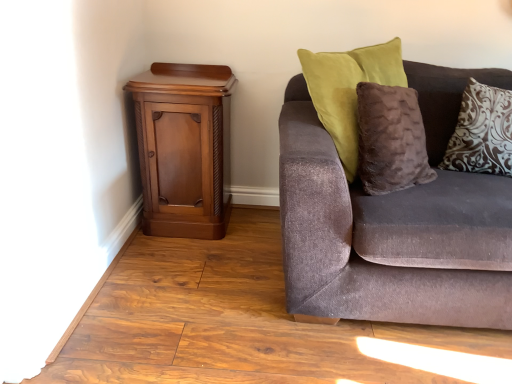
Question: Considering the relative sizes of velvet brown couch at right and brown damask pillow at upper right in the image provided, is velvet brown couch at right wider than brown damask pillow at upper right?

Choices:
 (A) yes
 (B) no

Answer: (A)

Question: Does velvet brown couch at right have a greater height compared to brown damask pillow at upper right?

Choices:
 (A) yes
 (B) no

Answer: (A)

Question: Does velvet brown couch at right turn towards brown damask pillow at upper right?

Choices:
 (A) no
 (B) yes

Answer: (B)

Question: From the image's perspective, is velvet brown couch at right located beneath brown damask pillow at upper right?

Choices:
 (A) yes
 (B) no

Answer: (A)

Question: From the image's perspective, is velvet brown couch at right over brown damask pillow at upper right?

Choices:
 (A) no
 (B) yes

Answer: (A)

Question: Would you say velvet brown couch at right is to the left or to the right of mahogany wood cabinet at left in the picture?

Choices:
 (A) right
 (B) left

Answer: (A)

Question: Is velvet brown couch at right wider or thinner than mahogany wood cabinet at left?

Choices:
 (A) wide
 (B) thin

Answer: (A)

Question: From a real-world perspective, is velvet brown couch at right positioned above or below mahogany wood cabinet at left?

Choices:
 (A) below
 (B) above

Answer: (B)

Question: Is point (397, 233) closer or farther from the camera than point (202, 201)?

Choices:
 (A) farther
 (B) closer

Answer: (B)

Question: Is point (349, 188) closer or farther from the camera than point (490, 119)?

Choices:
 (A) farther
 (B) closer

Answer: (B)

Question: Choose the correct answer: Is velvet brown couch at right inside brown damask pillow at upper right or outside it?

Choices:
 (A) outside
 (B) inside

Answer: (A)

Question: Is velvet brown couch at right wider or thinner than brown damask pillow at upper right?

Choices:
 (A) wide
 (B) thin

Answer: (A)

Question: Considering the relative positions of velvet brown couch at right and brown damask pillow at upper right in the image provided, is velvet brown couch at right to the left or to the right of brown damask pillow at upper right?

Choices:
 (A) right
 (B) left

Answer: (B)

Question: In the image, is brown damask pillow at upper right on the left side or the right side of mahogany wood cabinet at left?

Choices:
 (A) left
 (B) right

Answer: (B)

Question: Does point (477, 94) appear closer or farther from the camera than point (220, 233)?

Choices:
 (A) farther
 (B) closer

Answer: (B)